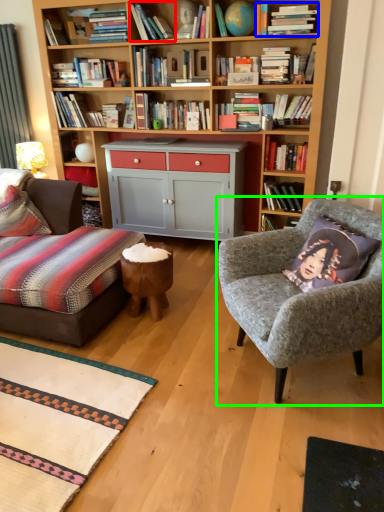
Question: Which object is positioned closest to book (highlighted by a red box)? Select from book (highlighted by a blue box) and chair (highlighted by a green box).

Choices:
 (A) book
 (B) chair

Answer: (A)